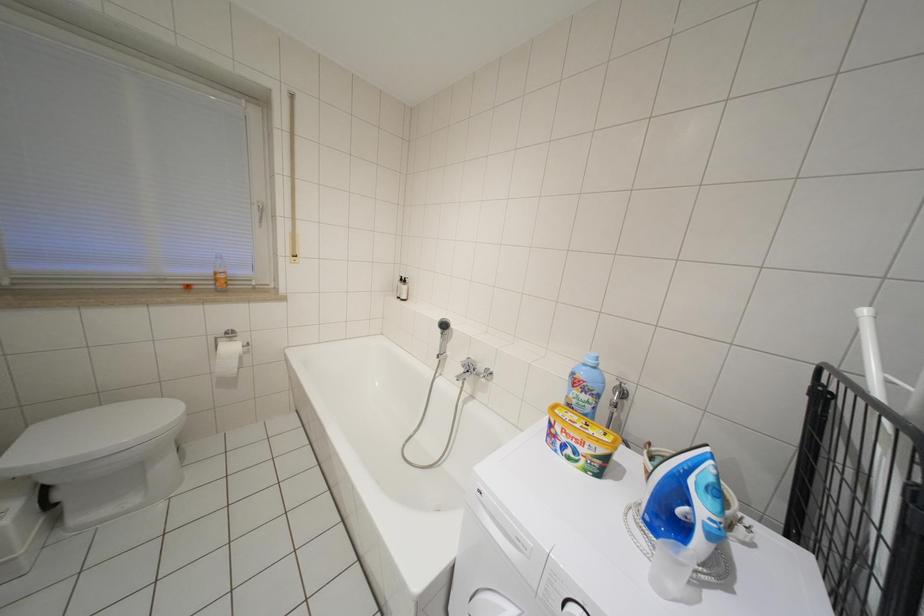
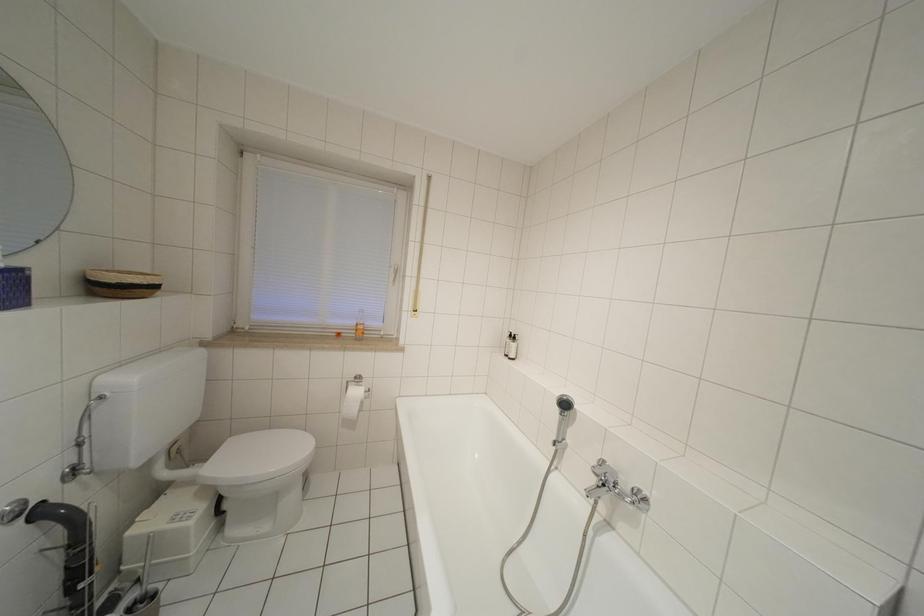
The images are taken continuously from a first-person perspective. In which direction are you moving?

The cameraman walked toward left, forward.